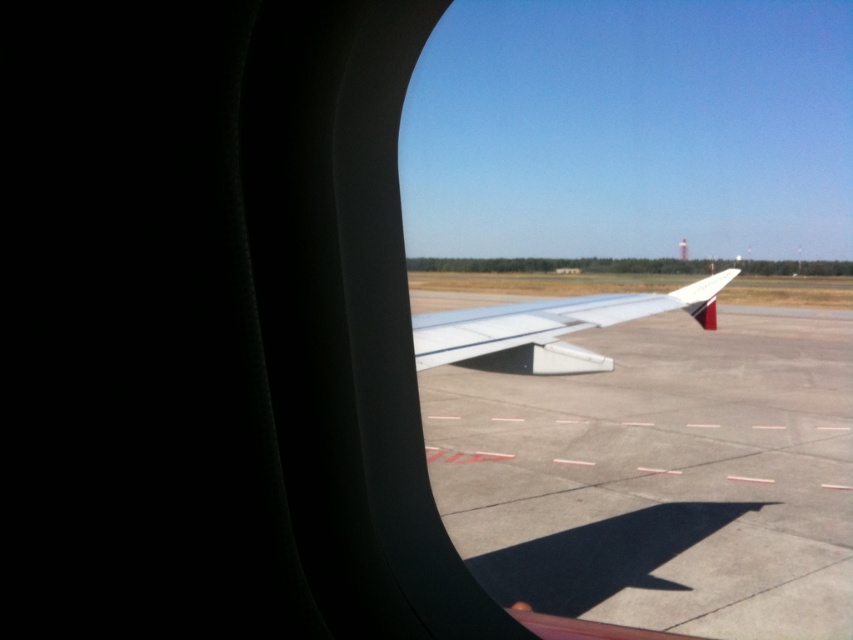
Between smooth concrete tarmac at center and white matte wing at center, which one appears on the left side from the viewer's perspective?

From the viewer's perspective, white matte wing at center appears more on the left side.

Between point (810, 470) and point (703, 278), which one is positioned behind?

Point (810, 470)

Where is `smooth concrete tarmac at center`? smooth concrete tarmac at center is located at coordinates (660, 476).